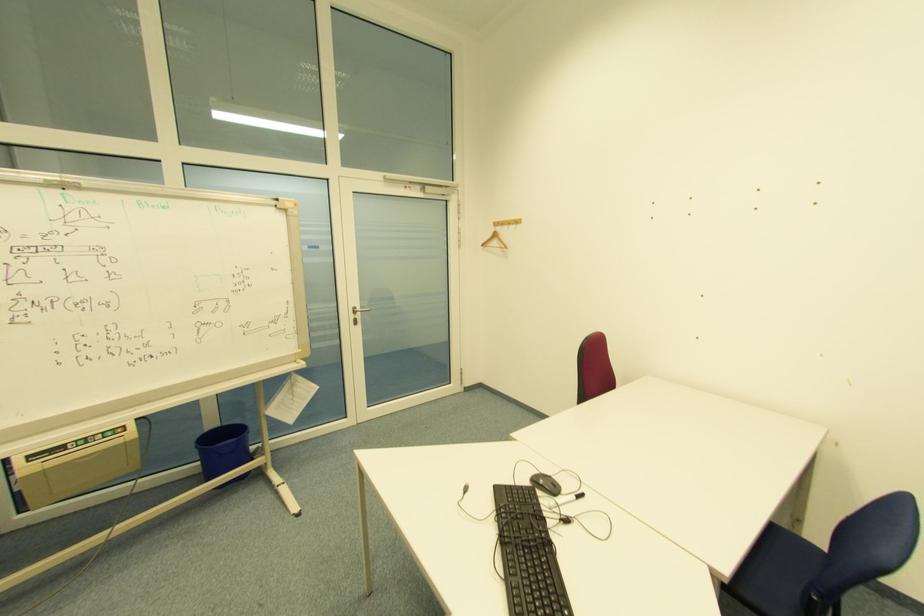
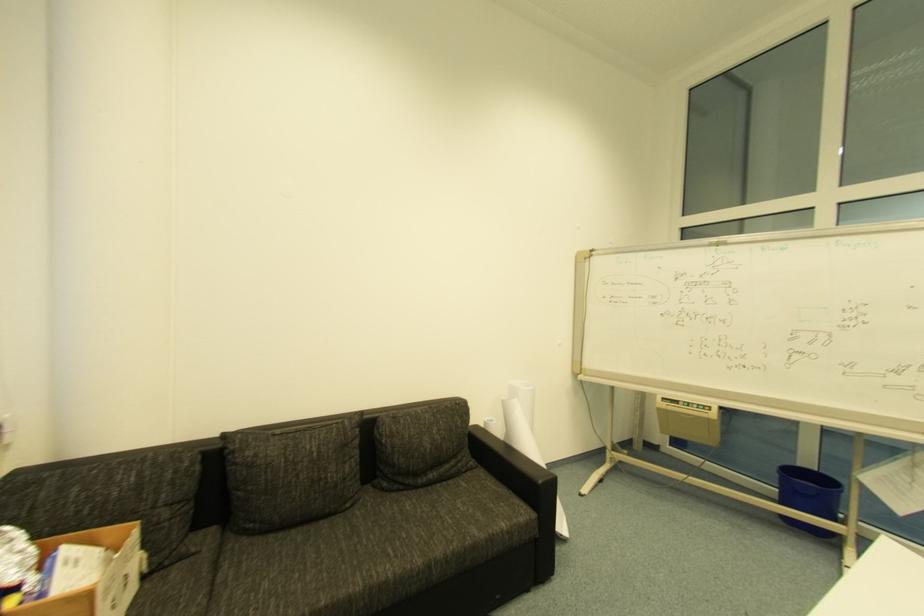
Question: How did the camera likely rotate?

Choices:
 (A) Left
 (B) Right
 (C) Up
 (D) Down

Answer: (A)